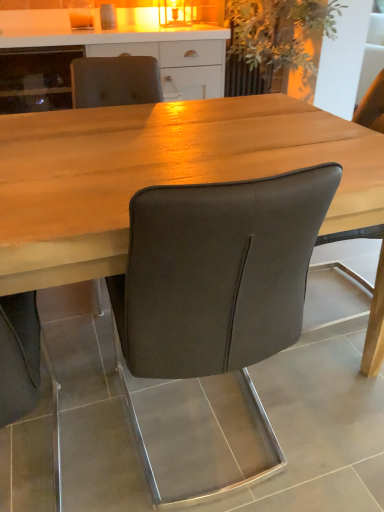
Describe the element at coordinates (278, 33) in the screenshot. I see `green leafy plant at upper center` at that location.

The image size is (384, 512). Identify the location of green leafy plant at upper center. (278, 33).

What do you see at coordinates (129, 48) in the screenshot? The height and width of the screenshot is (512, 384). I see `matte white cabinet at upper center` at bounding box center [129, 48].

Where is `dark gray leather chair at center`? The width and height of the screenshot is (384, 512). dark gray leather chair at center is located at coordinates tap(212, 322).

How different are the orientations of dark gray leather chair at center and wooden table at center in degrees?

89.3 degrees.

Which is closer, (269, 245) or (56, 115)?

Point (269, 245) is closer to the camera than point (56, 115).

Is dark gray leather chair at center further to the viewer compared to wooden table at center?

No, dark gray leather chair at center is closer to the camera.

Is dark gray leather chair at center placed right next to wooden table at center?

No.

From the picture: In the image, is matte white cabinet at upper center positioned in front of or behind green leafy plant at upper center?

matte white cabinet at upper center is behind green leafy plant at upper center.

From a real-world perspective, is matte white cabinet at upper center positioned under green leafy plant at upper center based on gravity?

Yes, from a real-world perspective, matte white cabinet at upper center is beneath green leafy plant at upper center.

Is matte white cabinet at upper center located outside green leafy plant at upper center?

Yes, matte white cabinet at upper center is not within green leafy plant at upper center.

From a real-world perspective, is wooden table at center above or below green leafy plant at upper center?

Clearly, from a real-world perspective, wooden table at center is below green leafy plant at upper center.

Is wooden table at center beside green leafy plant at upper center?

wooden table at center and green leafy plant at upper center are clearly separated.

Considering the positions of point (69, 239) and point (297, 2), is point (69, 239) closer or farther from the camera than point (297, 2)?

Clearly, point (69, 239) is closer to the camera than point (297, 2).

Could you tell me if wooden table at center is facing green leafy plant at upper center?

No, wooden table at center is not aimed at green leafy plant at upper center.

Is green leafy plant at upper center far from matte white cabinet at upper center?

No, green leafy plant at upper center is not far from matte white cabinet at upper center.

Consider the image. From the image's perspective, is green leafy plant at upper center located beneath matte white cabinet at upper center?

No, from the image's perspective, green leafy plant at upper center is not beneath matte white cabinet at upper center.

Looking at this image, is green leafy plant at upper center aimed at matte white cabinet at upper center?

No, green leafy plant at upper center is not oriented towards matte white cabinet at upper center.

Can you confirm if green leafy plant at upper center is bigger than matte white cabinet at upper center?

Yes.

Consider the image. Based on their positions, is dark gray leather chair at center located to the left or right of matte white cabinet at upper center?

From the image, it's evident that dark gray leather chair at center is to the right of matte white cabinet at upper center.

Is dark gray leather chair at center facing towards matte white cabinet at upper center?

Yes, dark gray leather chair at center is aimed at matte white cabinet at upper center.

Is dark gray leather chair at center spatially inside matte white cabinet at upper center, or outside of it?

dark gray leather chair at center is not inside matte white cabinet at upper center, it's outside.

Is green leafy plant at upper center to the left of wooden table at center from the viewer's perspective?

Incorrect, green leafy plant at upper center is not on the left side of wooden table at center.

The height and width of the screenshot is (512, 384). What are the coordinates of `plant that is behind the wooden table at center` in the screenshot? It's located at (278, 33).

How many degrees apart are the facing directions of green leafy plant at upper center and wooden table at center?

93.2 degrees separate the facing orientations of green leafy plant at upper center and wooden table at center.

Considering the positions of objects green leafy plant at upper center and wooden table at center in the image provided, who is in front, green leafy plant at upper center or wooden table at center?

Answer: wooden table at center is in front.

Based on the photo, which object is further away from the camera taking this photo, wooden table at center or matte white cabinet at upper center?

matte white cabinet at upper center is behind.

Is wooden table at center oriented towards matte white cabinet at upper center?

No, wooden table at center is not aimed at matte white cabinet at upper center.

From a real-world perspective, which is physically below, wooden table at center or matte white cabinet at upper center?

wooden table at center is physically lower.

Is wooden table at center touching matte white cabinet at upper center?

wooden table at center and matte white cabinet at upper center are clearly separated.

Locate an element on the screen. The image size is (384, 512). chair located on the right of wooden table at center is located at coordinates (212, 322).

What are the coordinates of `plant lying in front of the matte white cabinet at upper center` in the screenshot? It's located at pyautogui.click(x=278, y=33).

In the scene shown: Estimate the real-world distances between objects in this image. Which object is closer to dark gray leather chair at center, green leafy plant at upper center or matte white cabinet at upper center?

matte white cabinet at upper center.

From the image, which object appears to be nearer to green leafy plant at upper center, matte white cabinet at upper center or dark gray leather chair at center?

matte white cabinet at upper center lies closer to green leafy plant at upper center than the other object.

In the scene shown: Estimate the real-world distances between objects in this image. Which object is further from dark gray leather chair at center, wooden table at center or green leafy plant at upper center?

Among the two, green leafy plant at upper center is located further to dark gray leather chair at center.

Based on their spatial positions, is matte white cabinet at upper center or wooden table at center further from dark gray leather chair at center?

The object further to dark gray leather chair at center is matte white cabinet at upper center.

Based on their spatial positions, is matte white cabinet at upper center or wooden table at center closer to green leafy plant at upper center?

Among the two, matte white cabinet at upper center is located nearer to green leafy plant at upper center.

From the image, which object appears to be nearer to wooden table at center, green leafy plant at upper center or matte white cabinet at upper center?

Based on the image, matte white cabinet at upper center appears to be nearer to wooden table at center.

Estimate the real-world distances between objects in this image. Which object is further from matte white cabinet at upper center, green leafy plant at upper center or dark gray leather chair at center?

Based on the image, dark gray leather chair at center appears to be further to matte white cabinet at upper center.

In the scene shown: Estimate the real-world distances between objects in this image. Which object is further from wooden table at center, green leafy plant at upper center or dark gray leather chair at center?

Among the two, green leafy plant at upper center is located further to wooden table at center.

Where is `table located between dark gray leather chair at center and green leafy plant at upper center in the depth direction`? The width and height of the screenshot is (384, 512). table located between dark gray leather chair at center and green leafy plant at upper center in the depth direction is located at coordinates (158, 174).

I want to click on plant between wooden table at center and matte white cabinet at upper center along the z-axis, so click(278, 33).

Find the location of a particular element. This screenshot has width=384, height=512. table positioned between dark gray leather chair at center and matte white cabinet at upper center from near to far is located at coordinates (158, 174).

Find the location of a particular element. plant positioned between dark gray leather chair at center and matte white cabinet at upper center from near to far is located at coordinates (278, 33).